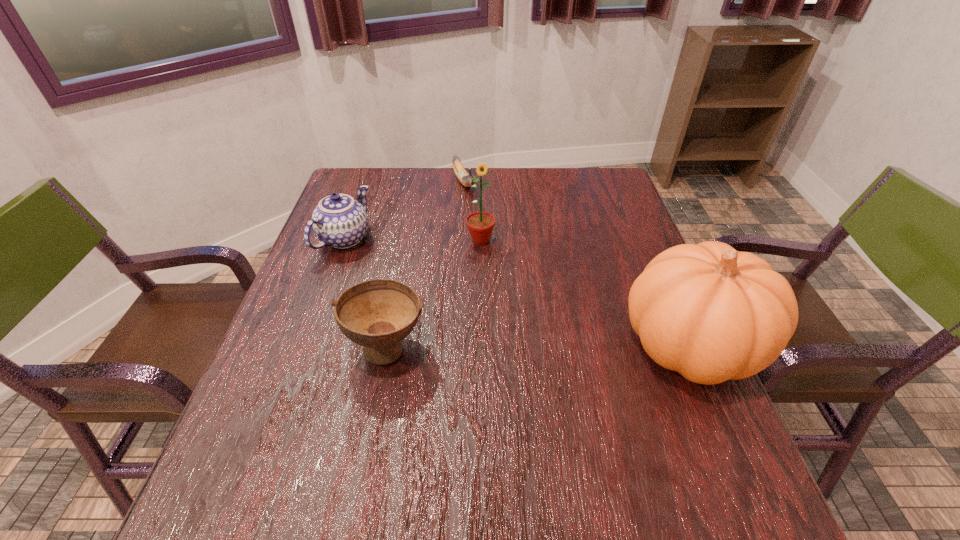
Image resolution: width=960 pixels, height=540 pixels. I want to click on soup bowl, so click(x=377, y=314).

This screenshot has width=960, height=540. Find the location of `the rightmost object`. the rightmost object is located at coordinates (711, 313).

Image resolution: width=960 pixels, height=540 pixels. In order to click on sunflower in this screenshot , I will do `click(480, 224)`.

The width and height of the screenshot is (960, 540). What are the coordinates of `chinaware` in the screenshot? It's located at (339, 221).

The height and width of the screenshot is (540, 960). I want to click on the farthest object, so click(465, 179).

Identify the location of banana. The image size is (960, 540). point(465,179).

The height and width of the screenshot is (540, 960). Identify the location of free space located 0.380m on the back of the second object from left to right. (412, 220).

This screenshot has width=960, height=540. I want to click on vacant region located 0.390m on the back of the pumpkin, so click(x=630, y=205).

The image size is (960, 540). Find the location of `free region located on the face of the sunflower`. free region located on the face of the sunflower is located at coordinates (496, 281).

Image resolution: width=960 pixels, height=540 pixels. Find the location of `vacant point located 0.200m on the face of the sunflower`. vacant point located 0.200m on the face of the sunflower is located at coordinates (504, 301).